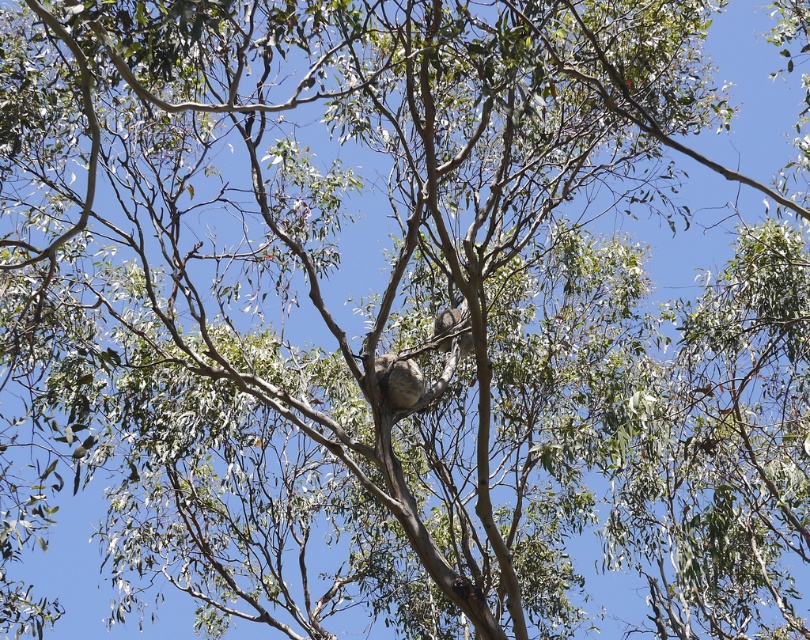
Is fuzzy brown koala at center wider than fuzzy gray koala at center?

Correct, the width of fuzzy brown koala at center exceeds that of fuzzy gray koala at center.

Can you confirm if fuzzy brown koala at center is taller than fuzzy gray koala at center?

Indeed, fuzzy brown koala at center has a greater height compared to fuzzy gray koala at center.

The height and width of the screenshot is (640, 810). I want to click on fuzzy brown koala at center, so [x=399, y=380].

This screenshot has height=640, width=810. I want to click on fuzzy brown koala at center, so click(x=399, y=380).